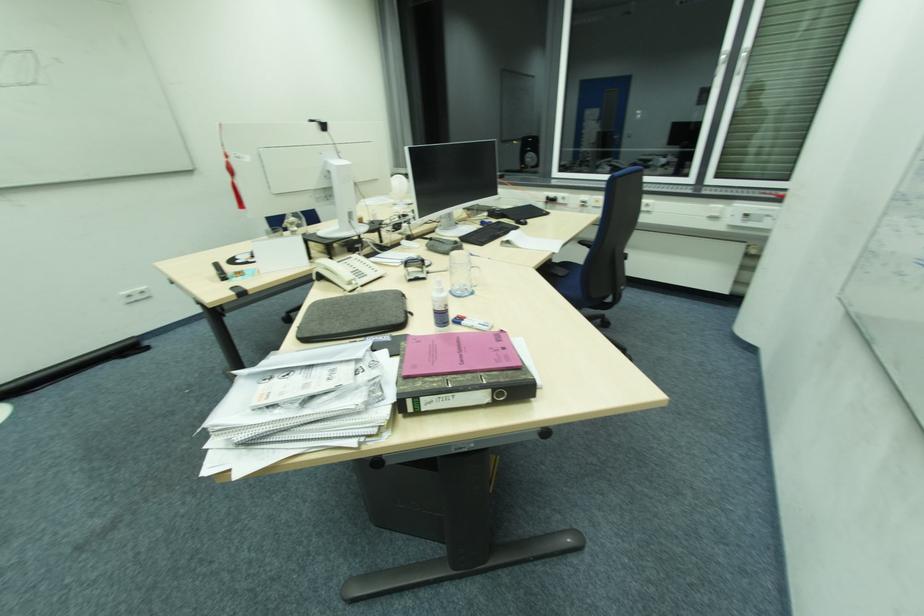
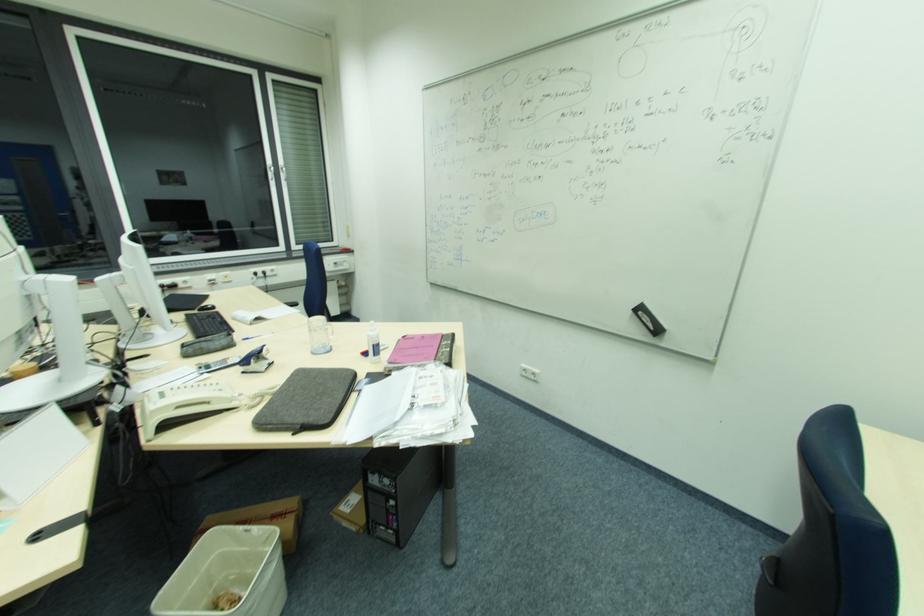
Where in the second image is the point corresponding to (x=436, y=310) from the first image?

(375, 345)